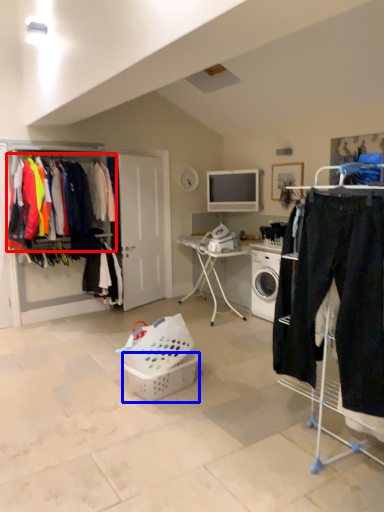
Question: Which object appears farthest to the camera in this image, clothing (highlighted by a red box) or basket (highlighted by a blue box)?

Choices:
 (A) clothing
 (B) basket

Answer: (A)